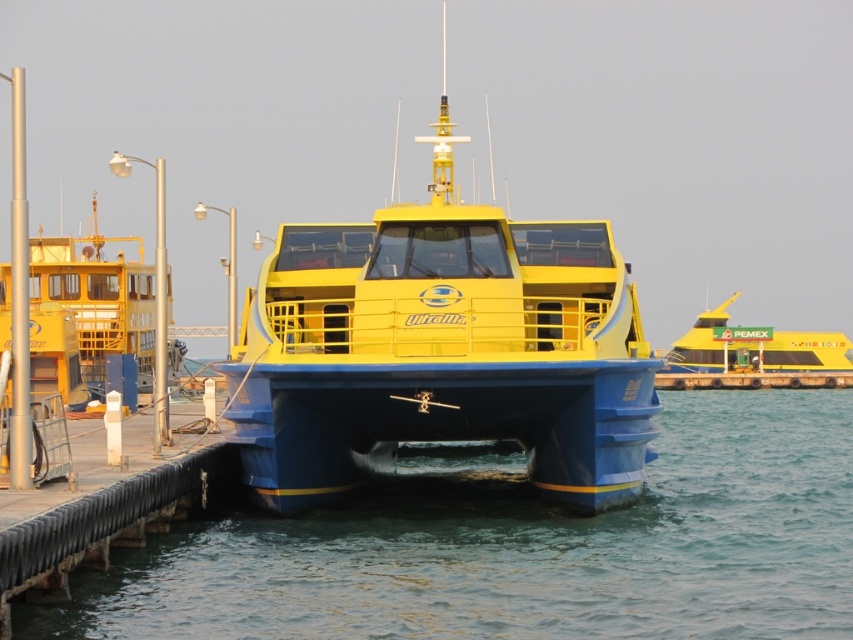
Does blue rubber water at center have a smaller size compared to yellow matte boat at upper right?

Yes, blue rubber water at center is smaller than yellow matte boat at upper right.

Can you confirm if blue rubber water at center is positioned above yellow matte boat at upper right?

No, blue rubber water at center is not above yellow matte boat at upper right.

Where is `blue rubber water at center`? blue rubber water at center is located at coordinates (523, 547).

Between point (498, 564) and point (146, 326), which one is positioned in front?

Point (498, 564) is in front.

Which is in front, point (408, 476) or point (123, 305)?

Point (408, 476) is in front.

The width and height of the screenshot is (853, 640). In order to click on blue rubber water at center in this screenshot , I will do `click(523, 547)`.

Who is more distant from viewer, [415,339] or [115,282]?

Positioned behind is point [115,282].

Between yellow matte boat at center and yellow matte boat at left, which one is positioned lower?

yellow matte boat at left is below.

Is point (393, 296) positioned behind point (149, 284)?

No, it is not.

You are a GUI agent. You are given a task and a screenshot of the screen. Output one action in this format:
    pyautogui.click(x=<x>, y=<y>)
    Task: Click on the yellow matte boat at center
    The width and height of the screenshot is (853, 640).
    Given the screenshot: What is the action you would take?
    pyautogui.click(x=442, y=349)